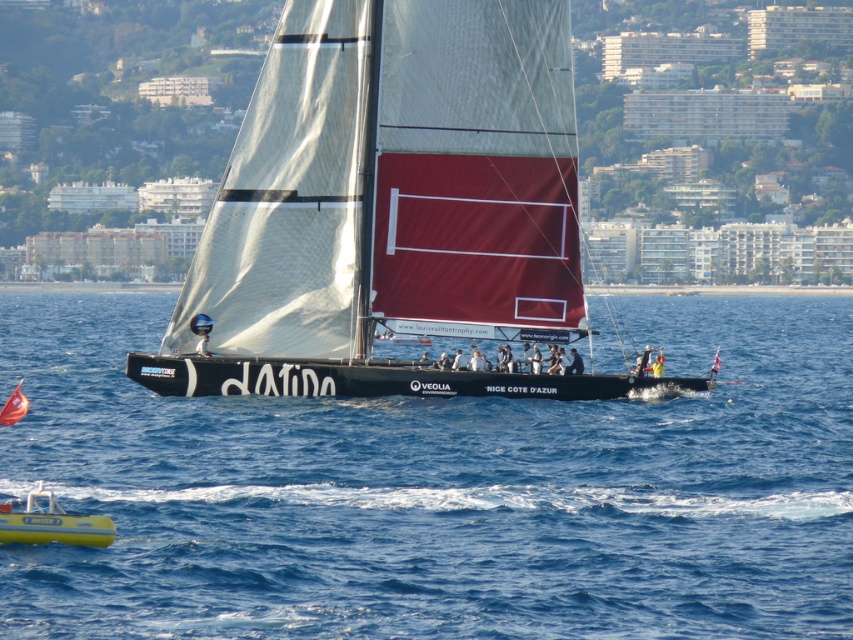
Question: Which point is closer to the camera taking this photo?

Choices:
 (A) (49, 525)
 (B) (440, 568)
 (C) (268, 257)

Answer: (A)

Question: Can you confirm if blue water at center is wider than yellow rubber dinghy at lower left?

Choices:
 (A) yes
 (B) no

Answer: (A)

Question: Which point appears farthest from the camera in this image?

Choices:
 (A) (107, 536)
 (B) (4, 467)
 (C) (505, 291)

Answer: (C)

Question: Can you confirm if white matte sail at center is smaller than yellow rubber dinghy at lower left?

Choices:
 (A) no
 (B) yes

Answer: (A)

Question: Is white matte sail at center below yellow rubber dinghy at lower left?

Choices:
 (A) yes
 (B) no

Answer: (B)

Question: Based on their relative distances, which object is nearer to the white matte sail at center?

Choices:
 (A) blue water at center
 (B) yellow rubber dinghy at lower left

Answer: (A)